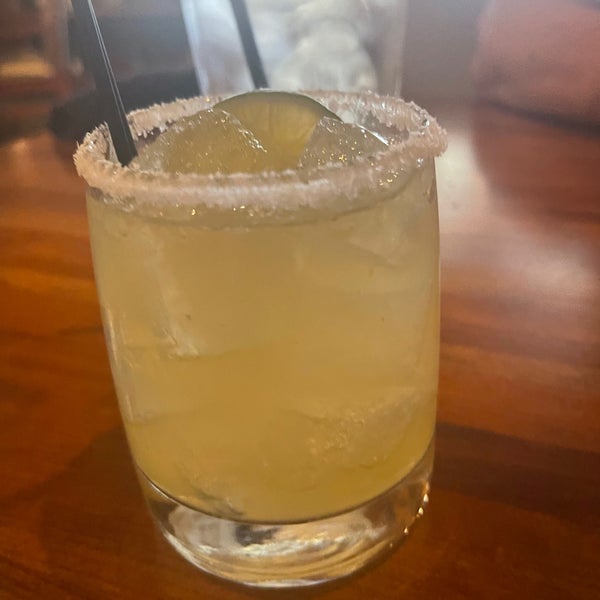
The height and width of the screenshot is (600, 600). Identify the location of base of cup. (368, 523).